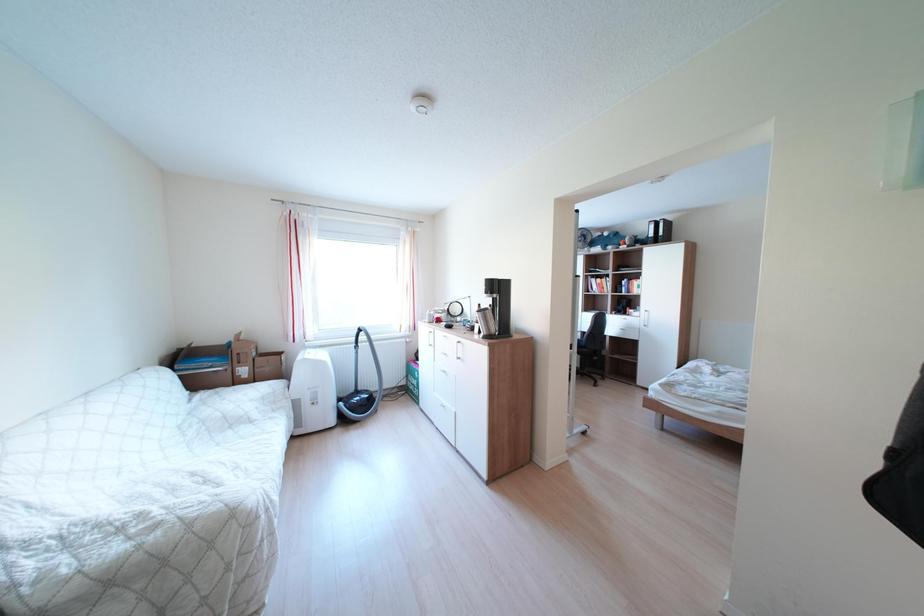
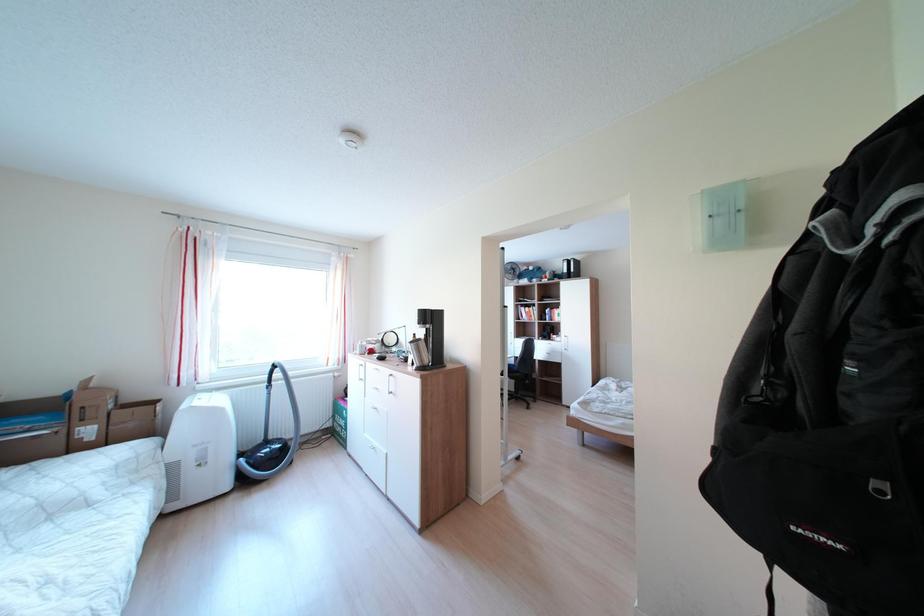
Question: What movement of the cameraman would produce the second image?

Choices:
 (A) Left
 (B) Right
 (C) Forward
 (D) Backward

Answer: (B)